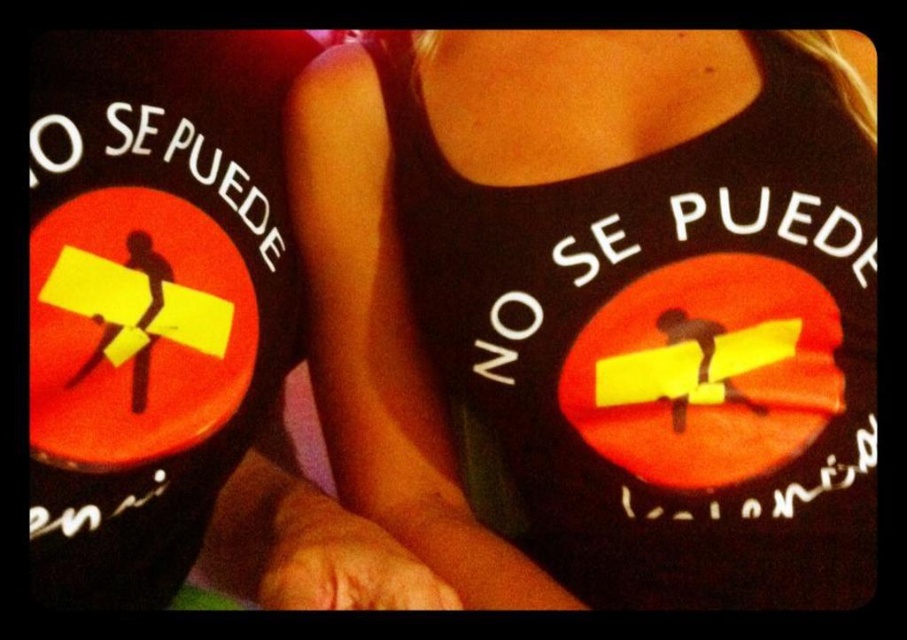
You are trying to see the full design of the black matte tank top at upper center but the black fabric tank top at center is blocking your view. Can you move around to see it better?

The black matte tank top at upper center is behind the black fabric tank top at center, so moving around might allow you to see it better by positioning yourself where the obstruction is minimized.

From the picture: You are standing in front of the two tank tops displayed in the image. Which point, point 1 at coordinates (791, 122) or point 2 at coordinates (372, 538), is closer to you?

Point 2 at coordinates (372, 538) is closer to you because it is in front of point 1 at coordinates (791, 122).